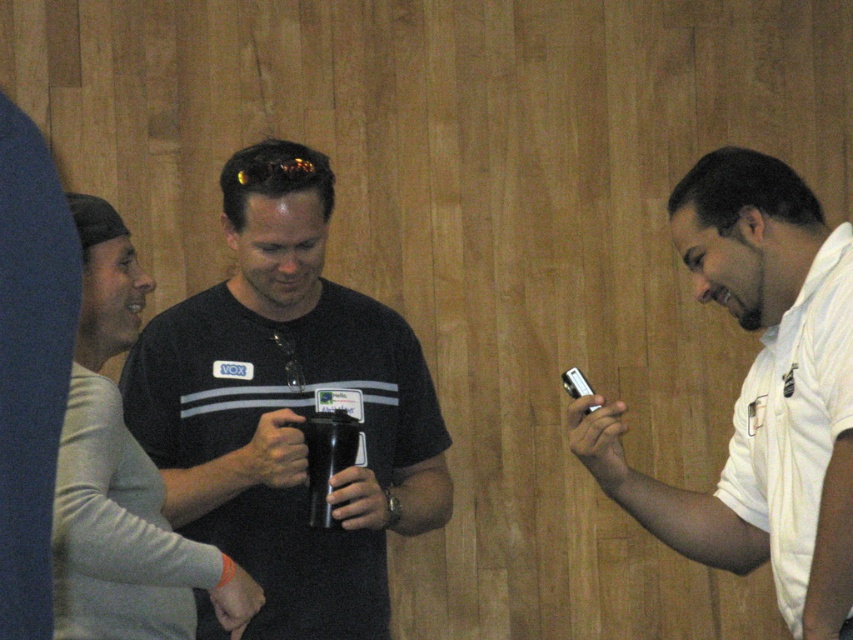
You are a tailor measuring the distance between two shirts in a store display. The shirts are the white matte shirt at right and the white cotton polo shirt at right. Can you fit a third shirt between them if the third shirt is 3 centimeters thick?

The distance between the white matte shirt at right and the white cotton polo shirt at right is 3.23 centimeters. Since the third shirt is 3 centimeters thick, it can fit between them as the available space is slightly larger than the shirt.

You are trying to decide which shirt to wear for a casual event. Both the white matte shirt at right and the white cotton polo shirt at right are options. Based on the image, which one is wider?

The white matte shirt at right is wider than the white cotton polo shirt at right according to the image description.